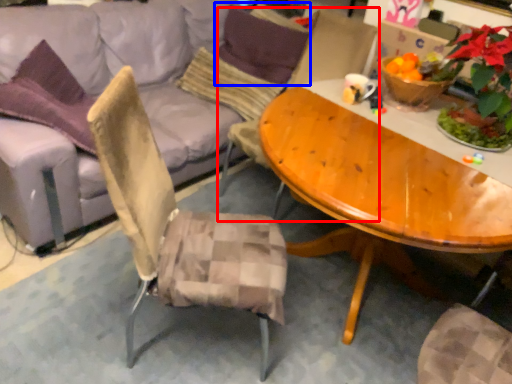
Question: Which object appears closest to the camera in this image, chair (highlighted by a red box) or pillow (highlighted by a blue box)?

Choices:
 (A) chair
 (B) pillow

Answer: (A)